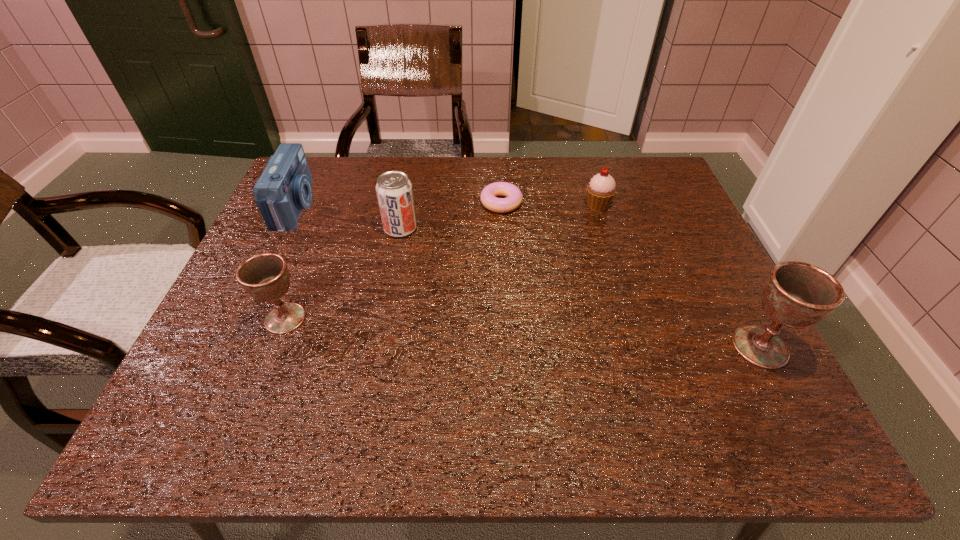
At what (x,y) coordinates should I click in order to perform the action: click on vacant space at the far right corner of the desktop. Please return your answer as a coordinate pair (x, y). Image resolution: width=960 pixels, height=540 pixels. Looking at the image, I should click on (636, 204).

Find the location of a particular element. Image resolution: width=960 pixels, height=540 pixels. free area in between the fifth object from right to left and the cupcake is located at coordinates (442, 262).

Locate an element on the screen. The width and height of the screenshot is (960, 540). blank region between the left chalice and the right chalice is located at coordinates (522, 333).

Locate an element on the screen. unoccupied position between the shortest object and the soda can is located at coordinates (451, 216).

Identify the location of unoccupied area between the cupcake and the tallest object. (679, 276).

Where is `free space between the fifth object from left to right and the rightmost object`? free space between the fifth object from left to right and the rightmost object is located at coordinates (679, 276).

Find the location of a particular element. The height and width of the screenshot is (540, 960). unoccupied area between the shortest object and the soda can is located at coordinates (451, 216).

The image size is (960, 540). I want to click on free point between the soda can and the right chalice, so click(580, 288).

You are a GUI agent. You are given a task and a screenshot of the screen. Output one action in this format:
    pyautogui.click(x=<x>, y=<y>)
    Task: Click on the free space between the second object from right to left and the left chalice
    
    Given the screenshot: What is the action you would take?
    pyautogui.click(x=442, y=262)

Point out which object is positioned as the fifth nearest to the third object from right to left. Please provide its 2D coordinates. Your answer should be formatted as a tuple, i.e. [(x, y)], where the tuple contains the x and y coordinates of a point satisfying the conditions above.

[(796, 294)]